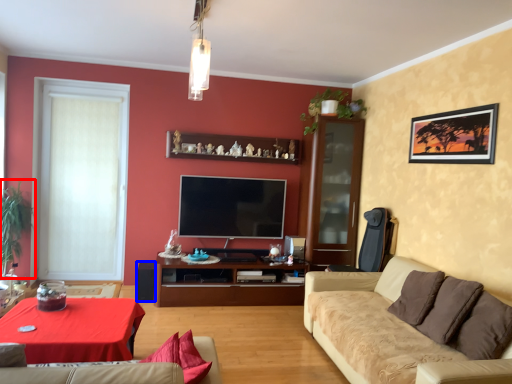
Question: Which of the following is the closest to the observer, plant (highlighted by a red box) or speaker (highlighted by a blue box)?

Choices:
 (A) plant
 (B) speaker

Answer: (A)